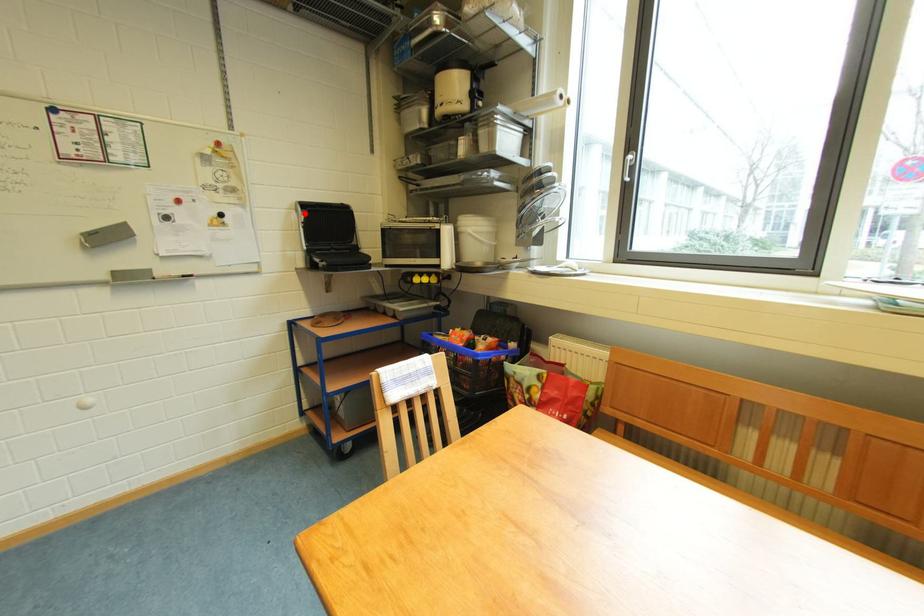
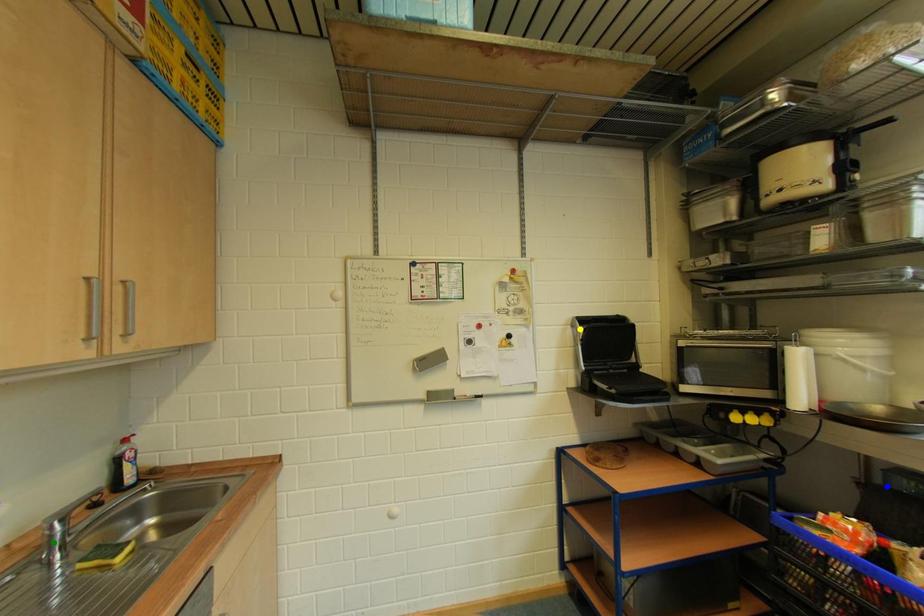
Question: I am providing you with two images of the same scene from different viewpoints. A red point is marked on the first image. You are given multiple points on the second image. Which point in image 2 is actually the same real-world point as the red point in image 1?

Choices:
 (A) blue point
 (B) yellow point
 (C) green point

Answer: (B)